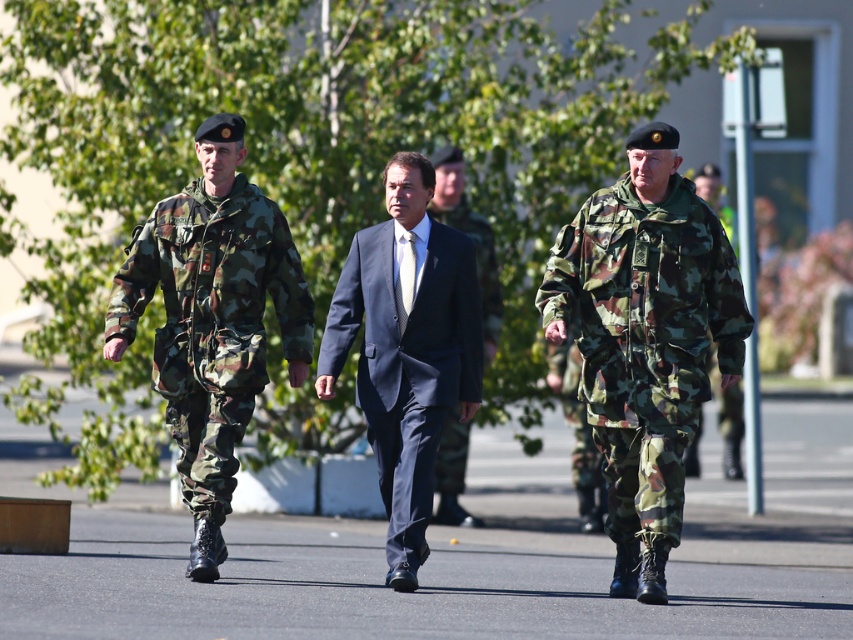
Does point (134, 317) lie in front of point (374, 289)?

Yes.

Is the position of camouflage fabric uniform at left less distant than that of navy blue suit at center?

Yes.

The image size is (853, 640). Find the location of `camouflage fabric uniform at left`. camouflage fabric uniform at left is located at coordinates (212, 320).

Who is shorter, navy blue suit at center or camouflage fabric uniform at right?

navy blue suit at center is shorter.

Between point (421, 216) and point (735, 253), which one is positioned behind?

The point (735, 253) is more distant.

Identify the location of navy blue suit at center. (405, 349).

Locate an element on the screen. This screenshot has width=853, height=640. navy blue suit at center is located at coordinates (405, 349).

Does navy blue suit at center have a greater width compared to dark blue suit at center?

Yes, navy blue suit at center is wider than dark blue suit at center.

Which is more to the right, navy blue suit at center or dark blue suit at center?

dark blue suit at center

Between point (340, 305) and point (491, 259), which one is positioned in front?

Point (340, 305)

Find the location of a particular element. The height and width of the screenshot is (640, 853). navy blue suit at center is located at coordinates (405, 349).